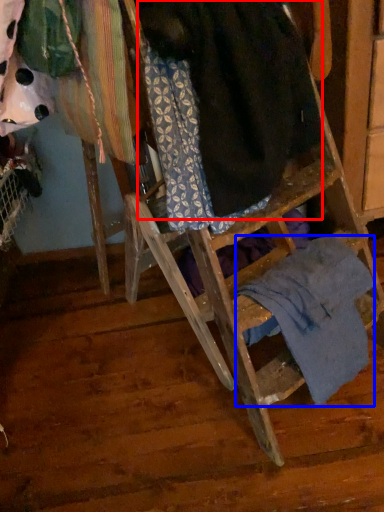
Question: Which object appears farthest to the camera in this image, wool (highlighted by a red box) or underclothes (highlighted by a blue box)?

Choices:
 (A) wool
 (B) underclothes

Answer: (B)